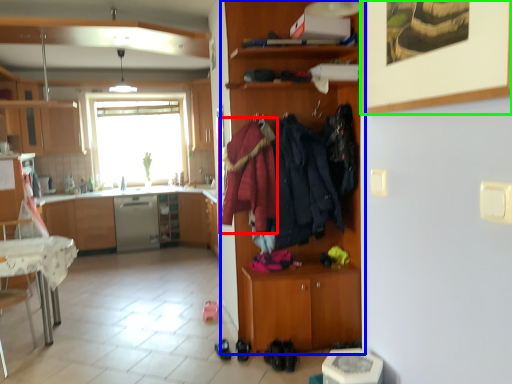
Question: Estimate the real-world distances between objects in this image. Which object is closer to clothing (highlighted by a red box), cabinetry (highlighted by a blue box) or picture frame (highlighted by a green box)?

Choices:
 (A) cabinetry
 (B) picture frame

Answer: (A)